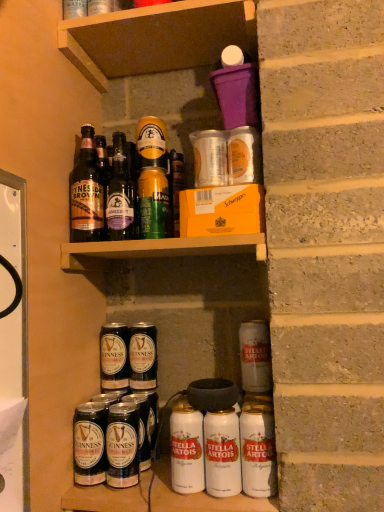
Locate an element on the screen. The image size is (384, 512). dark brown glass bottles at center, which ranks as the 3th beer in right-to-left order is located at coordinates (114, 358).

This screenshot has height=512, width=384. Describe the element at coordinates (143, 357) in the screenshot. I see `dark brown glass bottle at center, which is the 2th beer in back-to-front order` at that location.

The image size is (384, 512). Describe the element at coordinates (87, 193) in the screenshot. I see `brown glass bottles at upper left, the second bottle in the right-to-left sequence` at that location.

Measure the distance between point (121, 452) and camera.

The depth of point (121, 452) is 31.65 inches.

This screenshot has height=512, width=384. In order to click on dark brown glass bottle at lower center in this screenshot , I will do `click(123, 446)`.

The width and height of the screenshot is (384, 512). Identify the location of green matte can at upper center, the first yoghurt positioned from the back. (152, 179).

What is the approximate height of brown wood shelf at upper center?

2.65 inches.

Image resolution: width=384 pixels, height=512 pixels. Find the location of `white matte can at lower center, the second yoghurt positioned from the front`. white matte can at lower center, the second yoghurt positioned from the front is located at coordinates (186, 449).

Is dark brown glass bottle at lower center not near matte glass bottle at upper center, the first bottle from the right?

That's not correct — dark brown glass bottle at lower center is a little close to matte glass bottle at upper center, the first bottle from the right.

From a real-world perspective, does dark brown glass bottle at lower center stand above matte glass bottle at upper center, the first bottle from the right?

No, from a real-world perspective, dark brown glass bottle at lower center is not above matte glass bottle at upper center, the first bottle from the right.

Can you confirm if dark brown glass bottle at lower center is positioned to the right of matte glass bottle at upper center, the first bottle from the right?

Indeed, dark brown glass bottle at lower center is positioned on the right side of matte glass bottle at upper center, the first bottle from the right.

From the image's perspective, is dark brown glass bottle at lower center located above matte glass bottle at upper center, the first bottle from the right?

Incorrect, from the image's perspective, dark brown glass bottle at lower center is lower than matte glass bottle at upper center, the first bottle from the right.

From a real-world perspective, between white matte can at lower center, the 1th yoghurt positioned from the bottom, and white matte can at lower right, the 4th beer viewed from the back, who is vertically higher?

white matte can at lower right, the 4th beer viewed from the back.

Is white matte can at lower center, the 1th yoghurt positioned from the bottom, wider or thinner than white matte can at lower right, which appears as the fourth beer when viewed from the left?

Clearly, white matte can at lower center, the 1th yoghurt positioned from the bottom, has more width compared to white matte can at lower right, which appears as the fourth beer when viewed from the left.

In the scene shown: From the image's perspective, is white matte can at lower center, positioned as the second yoghurt in right-to-left order, over white matte can at lower right, the 1th beer when ordered from front to back?

No, from the image's perspective, white matte can at lower center, positioned as the second yoghurt in right-to-left order, is not on top of white matte can at lower right, the 1th beer when ordered from front to back.

Which is more to the right, white matte can at lower center, the 1th yoghurt positioned from the bottom, or white matte can at lower right, the 4th beer viewed from the back?

Positioned to the right is white matte can at lower right, the 4th beer viewed from the back.

Is white matte can at lower right, the 4th beer viewed from the back, to the right of metallic silver can at lower center, which appears as the first yoghurt when viewed from the front, from the viewer's perspective?

Yes, white matte can at lower right, the 4th beer viewed from the back, is to the right of metallic silver can at lower center, which appears as the first yoghurt when viewed from the front.

Considering the positions of point (266, 449) and point (223, 479), is point (266, 449) closer or farther from the camera than point (223, 479)?

Point (266, 449) is positioned closer to the camera compared to point (223, 479).

Based on the photo, are white matte can at lower right, the first beer positioned from the right, and metallic silver can at lower center, which appears as the second yoghurt when ordered from the bottom, located far from each other?

That's not correct — white matte can at lower right, the first beer positioned from the right, is a little close to metallic silver can at lower center, which appears as the second yoghurt when ordered from the bottom.

Would you say white matte can at lower right, the first beer positioned from the right, is outside metallic silver can at lower center, acting as the 3th yoghurt starting from the left?

Absolutely, white matte can at lower right, the first beer positioned from the right, is external to metallic silver can at lower center, acting as the 3th yoghurt starting from the left.

From a real-world perspective, between matte glass bottle at upper center, which is the second bottle in left-to-right order, and dark brown glass bottle at center, which appears as the 3th beer when viewed from the front, who is vertically lower?

In real-world perspective, dark brown glass bottle at center, which appears as the 3th beer when viewed from the front, is lower.

From their relative heights in the image, would you say matte glass bottle at upper center, which is the second bottle in left-to-right order, is taller or shorter than dark brown glass bottle at center, which is the 2th beer in back-to-front order?

In the image, matte glass bottle at upper center, which is the second bottle in left-to-right order, appears to be taller than dark brown glass bottle at center, which is the 2th beer in back-to-front order.

Could dark brown glass bottle at center, which appears as the 3th beer when viewed from the front, be considered to be inside matte glass bottle at upper center, which is the second bottle in left-to-right order?

Definitely not — dark brown glass bottle at center, which appears as the 3th beer when viewed from the front, is not inside matte glass bottle at upper center, which is the second bottle in left-to-right order.

Would you say dark brown glass bottle at center, which is counted as the 3th beer, starting from the left, is to the left or to the right of dark brown glass bottle at lower left, the 3th beer in the back-to-front sequence, in the picture?

Based on their positions, dark brown glass bottle at center, which is counted as the 3th beer, starting from the left, is located to the right of dark brown glass bottle at lower left, the 3th beer in the back-to-front sequence.

Considering the relative sizes of dark brown glass bottle at center, which is the 2th beer in back-to-front order, and dark brown glass bottle at lower left, the 3th beer in the back-to-front sequence, in the image provided, is dark brown glass bottle at center, which is the 2th beer in back-to-front order, wider than dark brown glass bottle at lower left, the 3th beer in the back-to-front sequence,?

→ Yes, dark brown glass bottle at center, which is the 2th beer in back-to-front order, is wider than dark brown glass bottle at lower left, the 3th beer in the back-to-front sequence.

Can you confirm if dark brown glass bottle at center, the second beer in the right-to-left sequence, is shorter than dark brown glass bottle at lower left, which is the first beer from left to right?

In fact, dark brown glass bottle at center, the second beer in the right-to-left sequence, may be taller than dark brown glass bottle at lower left, which is the first beer from left to right.

Does dark brown glass bottles at center, which ranks as the 3th beer in right-to-left order, have a lesser height compared to green matte can at upper center, placed as the 3th yoghurt when sorted from right to left?

No, dark brown glass bottles at center, which ranks as the 3th beer in right-to-left order, is not shorter than green matte can at upper center, placed as the 3th yoghurt when sorted from right to left.

From a real-world perspective, is dark brown glass bottles at center, which is counted as the 4th beer, starting from the front, physically below green matte can at upper center, placed as the 3th yoghurt when sorted from right to left?

Indeed, from a real-world perspective, dark brown glass bottles at center, which is counted as the 4th beer, starting from the front, is positioned beneath green matte can at upper center, placed as the 3th yoghurt when sorted from right to left.

Are dark brown glass bottles at center, which is counted as the 4th beer, starting from the front, and green matte can at upper center, which is counted as the 3th yoghurt, starting from the front, beside each other?

No, dark brown glass bottles at center, which is counted as the 4th beer, starting from the front, is not beside green matte can at upper center, which is counted as the 3th yoghurt, starting from the front.

Between dark brown glass bottles at center, the 1th beer positioned from the back, and green matte can at upper center, the 3th yoghurt when ordered from bottom to top, which one has smaller width?

With smaller width is green matte can at upper center, the 3th yoghurt when ordered from bottom to top.

Considering the positions of points (123, 174) and (110, 31), is point (123, 174) farther from camera compared to point (110, 31)?

No, (123, 174) is in front of (110, 31).

Which of these two, matte glass bottle at upper center, which is the second bottle in left-to-right order, or brown wood shelf at upper center, is thinner?

matte glass bottle at upper center, which is the second bottle in left-to-right order.

From the image's perspective, is matte glass bottle at upper center, the first bottle from the right, on brown wood shelf at upper center?

No, from the image's perspective, matte glass bottle at upper center, the first bottle from the right, is not over brown wood shelf at upper center.

Identify the location of bottle that is the 1st one when counting upward from the dark brown glass bottle at lower center (from the image's perspective). The image size is (384, 512). (120, 194).

You are a GUI agent. You are given a task and a screenshot of the screen. Output one action in this format:
    pyautogui.click(x=<x>, y=<y>)
    Task: Click on the 2nd yoghurt below the white matte can at lower right, the 1th beer when ordered from front to back (from the image's perspective)
    
    Given the screenshot: What is the action you would take?
    pyautogui.click(x=186, y=449)

Looking at the image, which one is located further to dark brown glass bottle at lower left, the fourth beer positioned from the right, metallic silver can at lower center, which appears as the second yoghurt when ordered from the bottom, or dark brown glass bottles at center, marked as the second beer in a left-to-right arrangement?

The object further to dark brown glass bottle at lower left, the fourth beer positioned from the right, is metallic silver can at lower center, which appears as the second yoghurt when ordered from the bottom.

Based on the photo, looking at the image, which one is located closer to metallic silver can at lower center, the third yoghurt when ordered from back to front, matte glass bottle at upper center, the first bottle from the right, or brown glass bottles at upper left, the second bottle in the right-to-left sequence?

matte glass bottle at upper center, the first bottle from the right, is closer to metallic silver can at lower center, the third yoghurt when ordered from back to front.

Based on the photo, when comparing their distances from green matte can at upper center, which is counted as the 3th yoghurt, starting from the front, does white matte can at lower right, the first beer positioned from the right, or brown glass bottles at upper left, the second bottle in the right-to-left sequence, seem closer?

brown glass bottles at upper left, the second bottle in the right-to-left sequence, is positioned closer to the anchor green matte can at upper center, which is counted as the 3th yoghurt, starting from the front.

From the image, which object appears to be farther from brown glass bottles at upper left, the first bottle positioned from the left, white matte can at lower right, the 1th beer when ordered from front to back, or dark brown glass bottle at lower left, the 2th beer in the front-to-back sequence?

Among the two, white matte can at lower right, the 1th beer when ordered from front to back, is located further to brown glass bottles at upper left, the first bottle positioned from the left.

Looking at the image, which one is located further to dark brown glass bottle at lower left, the fourth beer positioned from the right, brown wood shelf at upper center or white matte can at lower right, the 1th beer when ordered from front to back?

Based on the image, brown wood shelf at upper center appears to be further to dark brown glass bottle at lower left, the fourth beer positioned from the right.

Looking at the image, which one is located further to metallic silver can at lower center, the 2th yoghurt positioned from the top, dark brown glass bottle at center, which appears as the 3th beer when viewed from the front, or white matte can at lower right, the first beer positioned from the right?

Based on the image, dark brown glass bottle at center, which appears as the 3th beer when viewed from the front, appears to be further to metallic silver can at lower center, the 2th yoghurt positioned from the top.

From the image, which object appears to be farther from white matte can at lower right, the 4th beer viewed from the back, brown wood shelf at upper center or dark brown glass bottle at center, which is counted as the 3th beer, starting from the left?

brown wood shelf at upper center is further to white matte can at lower right, the 4th beer viewed from the back.

Looking at the image, which one is located further to dark brown glass bottle at center, which appears as the 3th beer when viewed from the front, metallic silver can at lower center, which appears as the second yoghurt when ordered from the bottom, or dark brown glass bottles at center, the 1th beer positioned from the back?

Among the two, metallic silver can at lower center, which appears as the second yoghurt when ordered from the bottom, is located further to dark brown glass bottle at center, which appears as the 3th beer when viewed from the front.

This screenshot has width=384, height=512. Find the location of `beverage between dark brown glass bottle at lower left, the 2th beer in the front-to-back sequence, and metallic silver can at lower center, the third yoghurt when ordered from back to front`. beverage between dark brown glass bottle at lower left, the 2th beer in the front-to-back sequence, and metallic silver can at lower center, the third yoghurt when ordered from back to front is located at coordinates (123, 446).

Identify the location of yoghurt that lies between brown glass bottles at upper left, the first bottle positioned from the left, and dark brown glass bottle at center, which is the 2th beer in back-to-front order, from top to bottom. The image size is (384, 512). (152, 179).

Locate an element on the screen. This screenshot has height=512, width=384. beverage located between dark brown glass bottle at lower left, the fourth beer positioned from the right, and white matte can at lower right, the 4th beer viewed from the back, in the left-right direction is located at coordinates (123, 446).

Identify the location of beverage between green matte can at upper center, the 3th yoghurt when ordered from bottom to top, and dark brown glass bottle at lower left, the 2th beer in the front-to-back sequence, vertically. pyautogui.click(x=123, y=446).